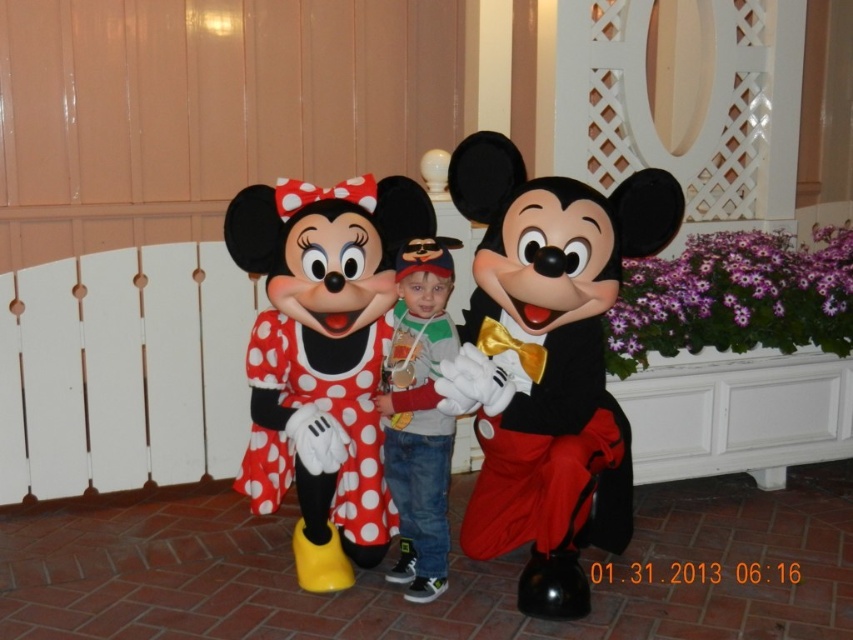
Question: Is matte black bow tie at center further to the viewer compared to matte polka dot dress at center?

Choices:
 (A) yes
 (B) no

Answer: (B)

Question: Which object appears closest to the camera in this image?

Choices:
 (A) jeans at center
 (B) red polka dot dress at center
 (C) matte polka dot dress at center

Answer: (C)

Question: Is matte black bow tie at center smaller than red polka dot dress at center?

Choices:
 (A) yes
 (B) no

Answer: (B)

Question: Does matte polka dot dress at center have a lesser width compared to red polka dot dress at center?

Choices:
 (A) yes
 (B) no

Answer: (B)

Question: Which point is closer to the camera?

Choices:
 (A) red polka dot dress at center
 (B) jeans at center
 (C) matte polka dot dress at center
 (D) matte black bow tie at center

Answer: (D)

Question: Which object appears closest to the camera in this image?

Choices:
 (A) matte polka dot dress at center
 (B) jeans at center

Answer: (A)